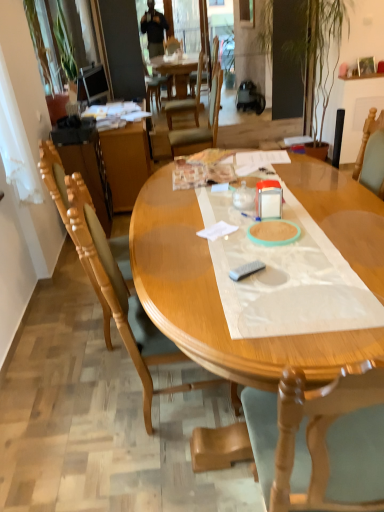
Locate an element on the screen. vacant space behind metallic silver container at center is located at coordinates (279, 197).